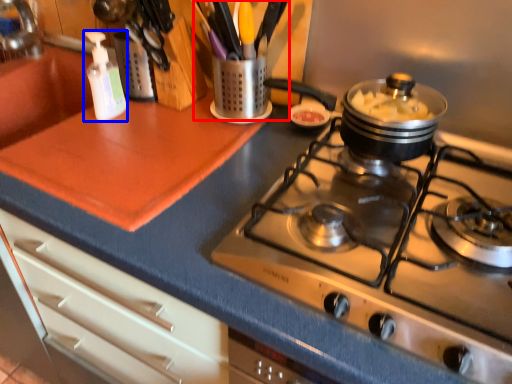
Question: Which of the following is the farthest to the observer, appliance (highlighted by a red box) or bottle (highlighted by a blue box)?

Choices:
 (A) appliance
 (B) bottle

Answer: (A)